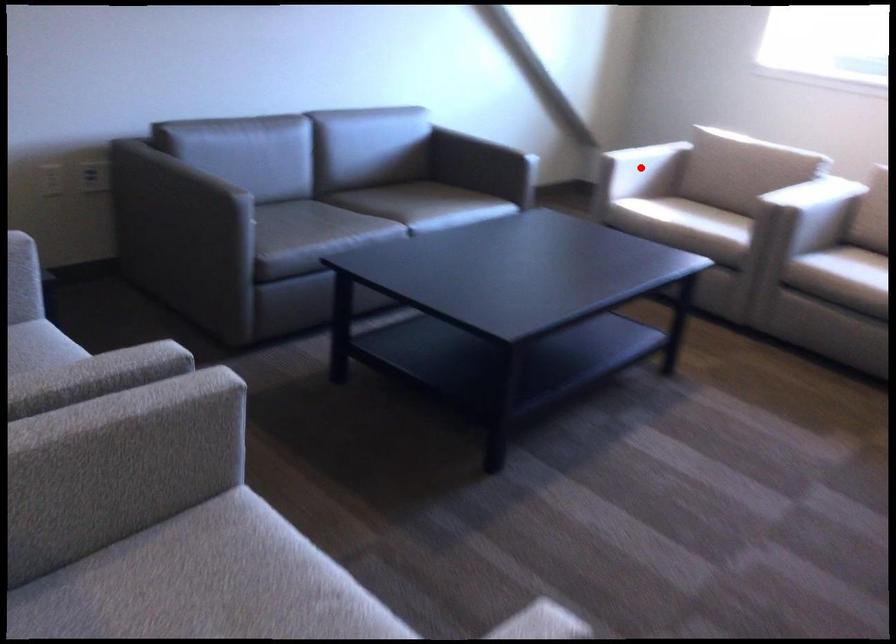
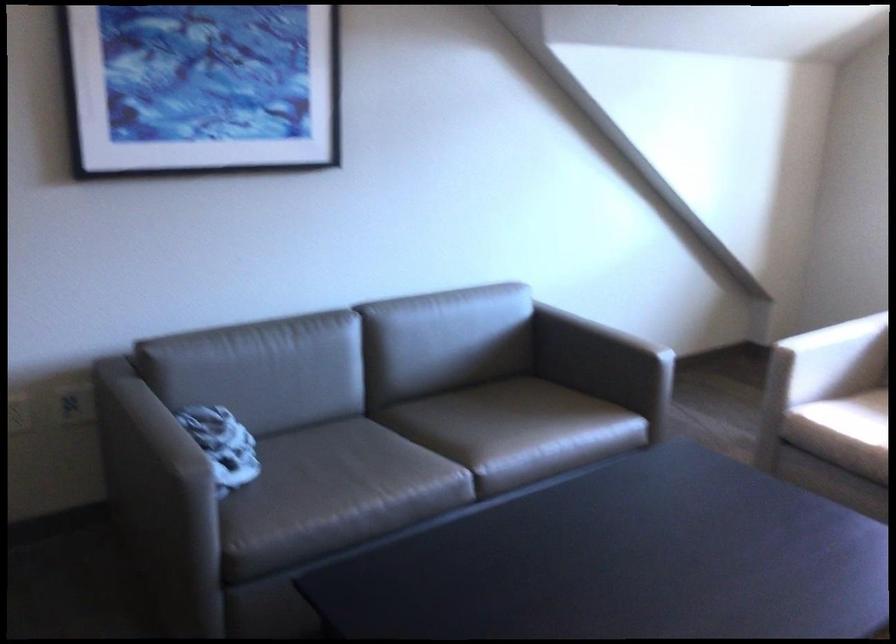
Question: I am providing you with two images of the same scene from different viewpoints. A red point is shown in image1. For the corresponding object point in image2, is it positioned nearer or farther from the camera?

Choices:
 (A) Nearer
 (B) Farther

Answer: (A)